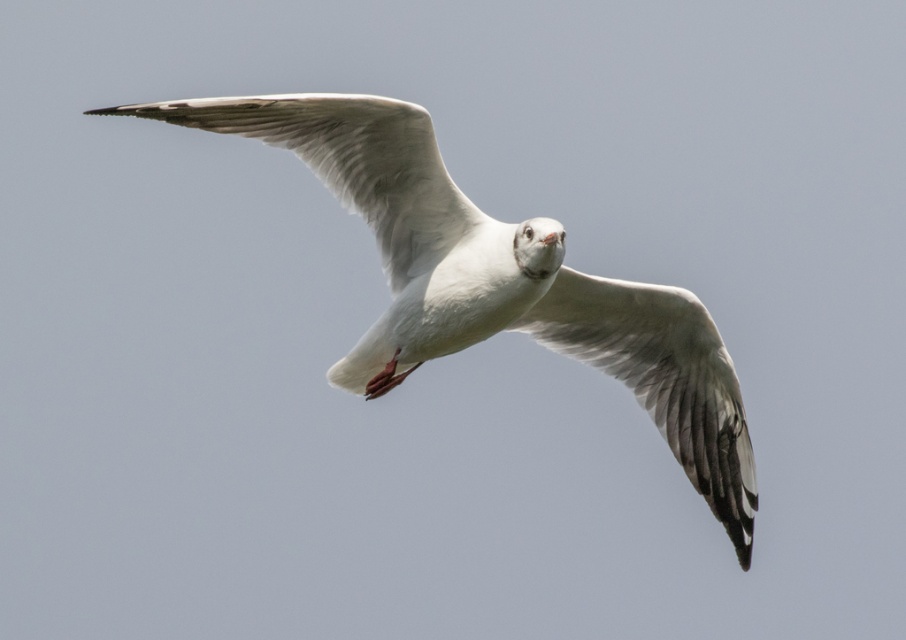
Is white feathered bird at center thinner than white feathered wing at center?

In fact, white feathered bird at center might be wider than white feathered wing at center.

Is white feathered bird at center to the left of white feathered wing at center from the viewer's perspective?

Indeed, white feathered bird at center is positioned on the left side of white feathered wing at center.

Does point (670, 433) lie in front of point (600, 326)?

That is False.

This screenshot has width=906, height=640. Identify the location of white feathered bird at center. (497, 282).

Is white feathered bird at center to the left of white feathered wing at upper center from the viewer's perspective?

In fact, white feathered bird at center is to the right of white feathered wing at upper center.

Who is more forward, [523,314] or [203,118]?

Point [203,118] is in front.

I want to click on white feathered bird at center, so click(x=497, y=282).

Is white feathered wing at center in front of white feathered wing at upper center?

No, it is behind white feathered wing at upper center.

Can you confirm if white feathered wing at center is wider than white feathered wing at upper center?

Incorrect, white feathered wing at center's width does not surpass white feathered wing at upper center's.

This screenshot has height=640, width=906. I want to click on white feathered wing at center, so click(661, 378).